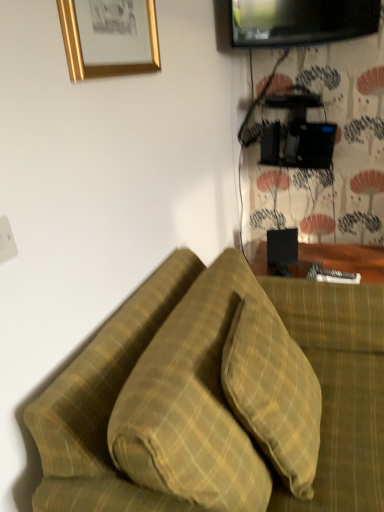
Question: Does yellow plaid pillow at center, the second pillow when ordered from left to right, come behind green plaid pillow at center, positioned as the 2th pillow in right-to-left order?

Choices:
 (A) yes
 (B) no

Answer: (A)

Question: Is yellow plaid pillow at center, the second pillow when ordered from left to right, oriented towards green plaid pillow at center, which ranks as the first pillow in left-to-right order?

Choices:
 (A) yes
 (B) no

Answer: (A)

Question: Is the position of yellow plaid pillow at center, the second pillow when ordered from left to right, less distant than that of green plaid pillow at center, positioned as the 2th pillow in right-to-left order?

Choices:
 (A) no
 (B) yes

Answer: (A)

Question: Does yellow plaid pillow at center, the first pillow viewed from the right, have a larger size compared to green plaid pillow at center, positioned as the 2th pillow in right-to-left order?

Choices:
 (A) no
 (B) yes

Answer: (A)

Question: Is yellow plaid pillow at center, the first pillow viewed from the right, beside green plaid pillow at center, positioned as the 2th pillow in right-to-left order?

Choices:
 (A) yes
 (B) no

Answer: (A)

Question: Considering the relative sizes of yellow plaid pillow at center, the first pillow viewed from the right, and green plaid pillow at center, which ranks as the first pillow in left-to-right order, in the image provided, is yellow plaid pillow at center, the first pillow viewed from the right, thinner than green plaid pillow at center, which ranks as the first pillow in left-to-right order,?

Choices:
 (A) yes
 (B) no

Answer: (A)

Question: Considering the relative positions of green plaid pillow at center, which ranks as the first pillow in left-to-right order, and black glossy tv at upper right in the image provided, is green plaid pillow at center, which ranks as the first pillow in left-to-right order, to the left of black glossy tv at upper right from the viewer's perspective?

Choices:
 (A) no
 (B) yes

Answer: (B)

Question: Is green plaid pillow at center, positioned as the 2th pillow in right-to-left order, closer to the viewer compared to black glossy tv at upper right?

Choices:
 (A) no
 (B) yes

Answer: (B)

Question: Is green plaid pillow at center, positioned as the 2th pillow in right-to-left order, bigger than black glossy tv at upper right?

Choices:
 (A) no
 (B) yes

Answer: (B)

Question: Considering the relative positions of green plaid pillow at center, positioned as the 2th pillow in right-to-left order, and black glossy tv at upper right in the image provided, is green plaid pillow at center, positioned as the 2th pillow in right-to-left order, behind black glossy tv at upper right?

Choices:
 (A) no
 (B) yes

Answer: (A)

Question: From the image's perspective, is green plaid pillow at center, positioned as the 2th pillow in right-to-left order, located beneath black glossy tv at upper right?

Choices:
 (A) yes
 (B) no

Answer: (A)

Question: Would you say green plaid pillow at center, positioned as the 2th pillow in right-to-left order, contains black glossy tv at upper right?

Choices:
 (A) no
 (B) yes

Answer: (A)

Question: From a real-world perspective, is gold metallic picture frame at upper left located beneath yellow plaid pillow at center, the second pillow when ordered from left to right?

Choices:
 (A) no
 (B) yes

Answer: (A)